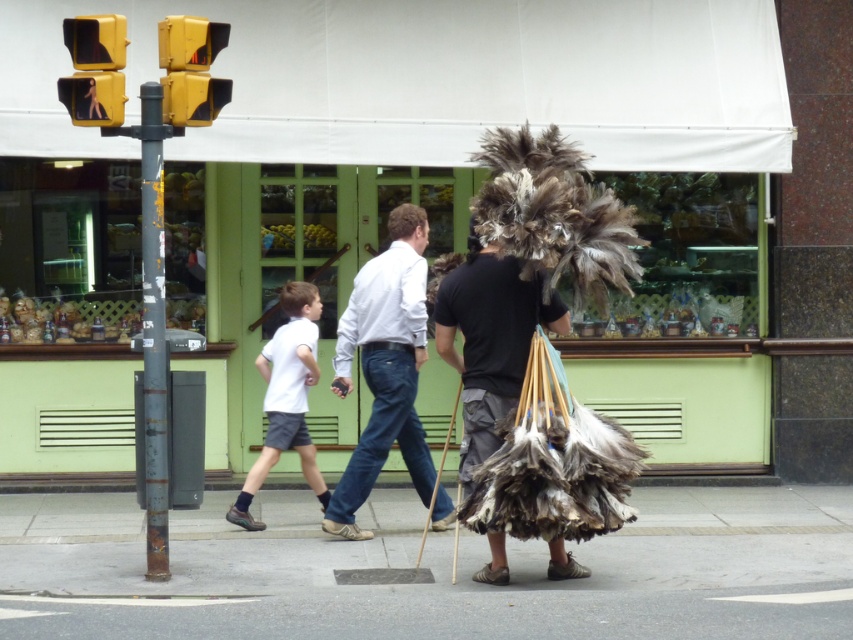
Question: Is light blue denim jeans at center further to the viewer compared to rusty metal pole at left?

Choices:
 (A) no
 (B) yes

Answer: (B)

Question: Which point is farther to the camera?

Choices:
 (A) rusty metal pole at left
 (B) yellow matte traffic light at upper left
 (C) light blue denim jeans at center

Answer: (C)

Question: Estimate the real-world distances between objects in this image. Which object is closer to the white cotton shirt at center?

Choices:
 (A) yellow matte traffic light at upper left
 (B) light blue denim jeans at center
 (C) feathered bundle at center
 (D) rusty metal pole at left

Answer: (B)

Question: Does feathered bundle at center come in front of yellow matte traffic light at upper left?

Choices:
 (A) yes
 (B) no

Answer: (A)

Question: Does light blue denim jeans at center have a lesser width compared to white cotton shirt at center?

Choices:
 (A) yes
 (B) no

Answer: (B)

Question: Which is farther from the yellow matte traffic light at upper left?

Choices:
 (A) white cotton shirt at center
 (B) light blue denim jeans at center

Answer: (A)